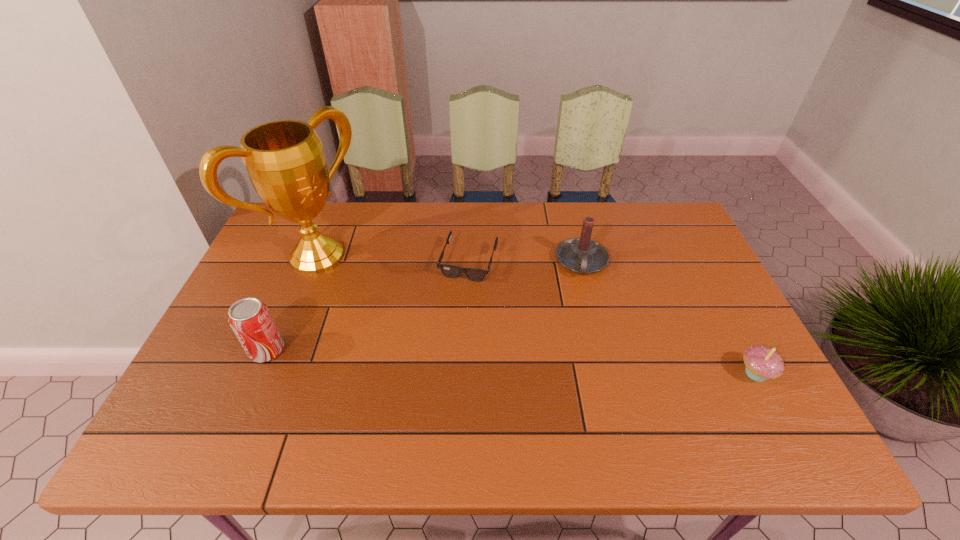
The height and width of the screenshot is (540, 960). Find the location of `vacant space on the desktop that is between the soda can and the rightmost object and is positioned on the front-facing side of the award`. vacant space on the desktop that is between the soda can and the rightmost object and is positioned on the front-facing side of the award is located at coordinates (457, 359).

Where is `vacant space on the desktop that is between the soda can and the cupcake and is positioned on the side of the candle with the handle loop`? This screenshot has width=960, height=540. vacant space on the desktop that is between the soda can and the cupcake and is positioned on the side of the candle with the handle loop is located at coordinates (580, 365).

At what (x,y) coordinates should I click in order to perform the action: click on vacant spot on the desktop that is between the soda can and the cupcake and is positioned on the temples of the sunglasses. Please return your answer as a coordinate pair (x, y). Image resolution: width=960 pixels, height=540 pixels. Looking at the image, I should click on (436, 358).